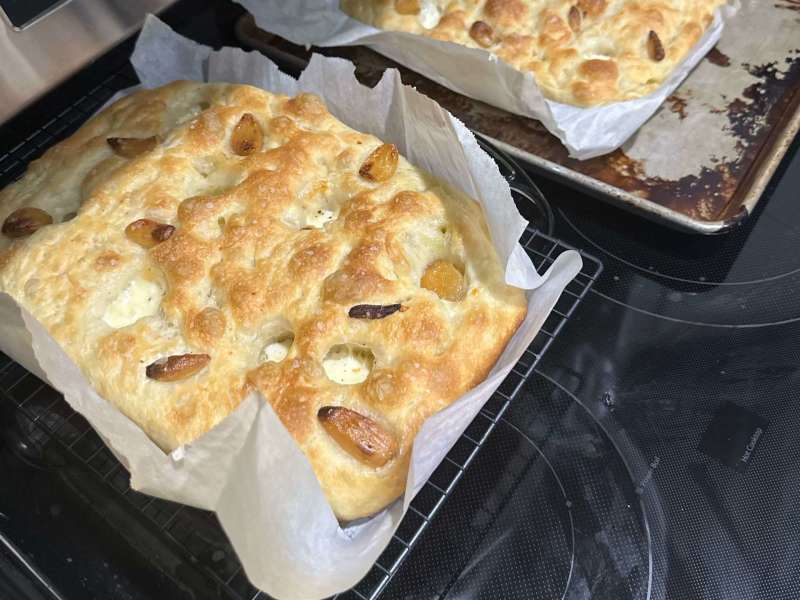
Where is `metal cooling rack`? This screenshot has width=800, height=600. metal cooling rack is located at coordinates (498, 411).